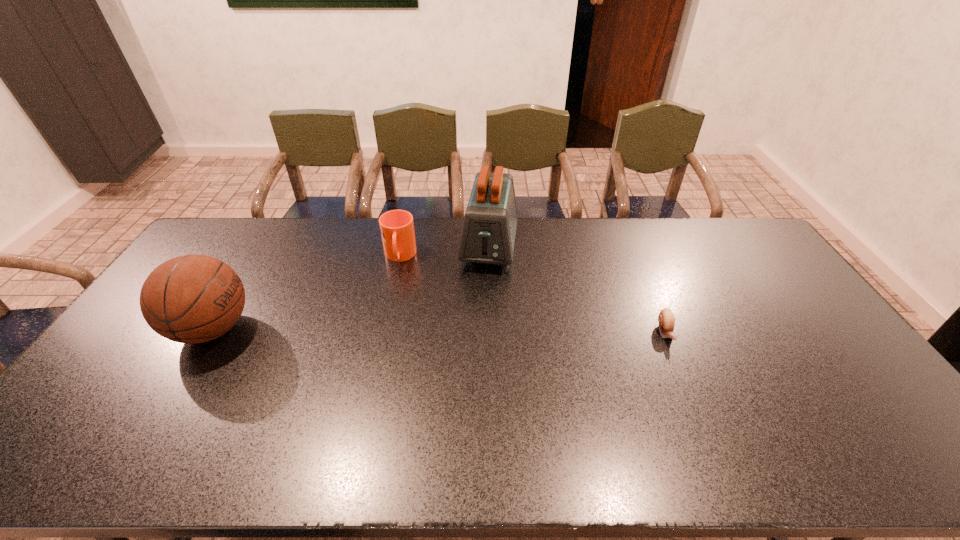
You are a GUI agent. You are given a task and a screenshot of the screen. Output one action in this format:
    pyautogui.click(x=<x>, y=<y>)
    Task: Click on the free space at the near edge of the desktop
    
    Given the screenshot: What is the action you would take?
    pyautogui.click(x=174, y=414)

This screenshot has width=960, height=540. I want to click on vacant space at the right edge of the desktop, so click(x=867, y=391).

This screenshot has height=540, width=960. Find the location of `free space at the far left corner of the desktop`. free space at the far left corner of the desktop is located at coordinates (241, 246).

In the image, there is a desktop. In order to click on vacant space at the far right corner in this screenshot , I will do `click(749, 242)`.

At what (x,y) coordinates should I click in order to perform the action: click on free space between the basketball and the shortest object. Please return your answer as a coordinate pair (x, y). The height and width of the screenshot is (540, 960). Looking at the image, I should click on click(x=439, y=330).

Locate an element on the screen. This screenshot has width=960, height=540. empty space between the toaster and the shortest object is located at coordinates (577, 289).

Where is `vacant point located between the third tallest object and the shortest object`? This screenshot has height=540, width=960. vacant point located between the third tallest object and the shortest object is located at coordinates pos(533,294).

At what (x,y) coordinates should I click in order to perform the action: click on unoccupied area between the rightmost object and the mug. Please return your answer as a coordinate pair (x, y). This screenshot has width=960, height=540. Looking at the image, I should click on (533, 294).

Find the location of `free space between the rightmost object and the second tallest object`. free space between the rightmost object and the second tallest object is located at coordinates (439, 330).

Find the location of a particular element. Image resolution: width=960 pixels, height=540 pixels. unoccupied area between the shortest object and the third object from right to left is located at coordinates (533, 294).